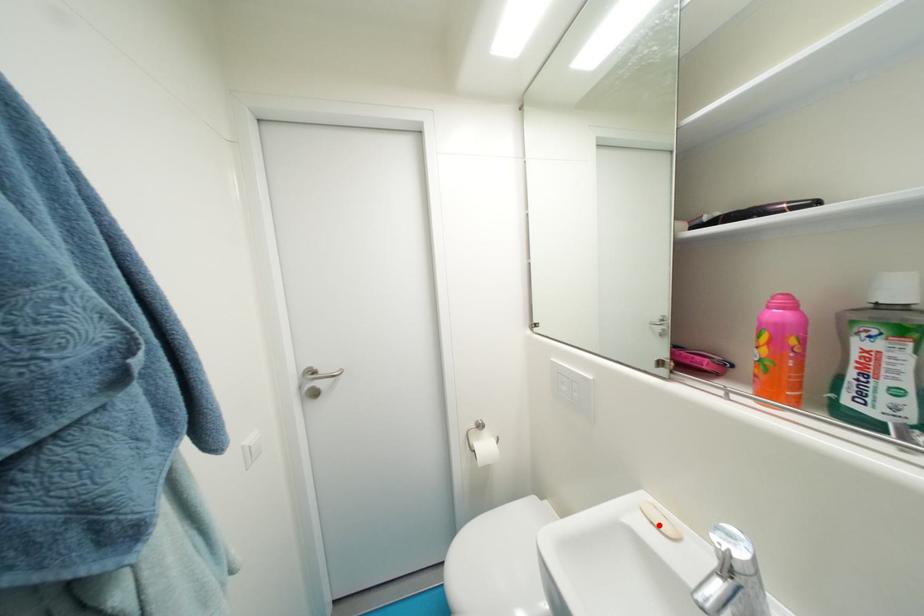
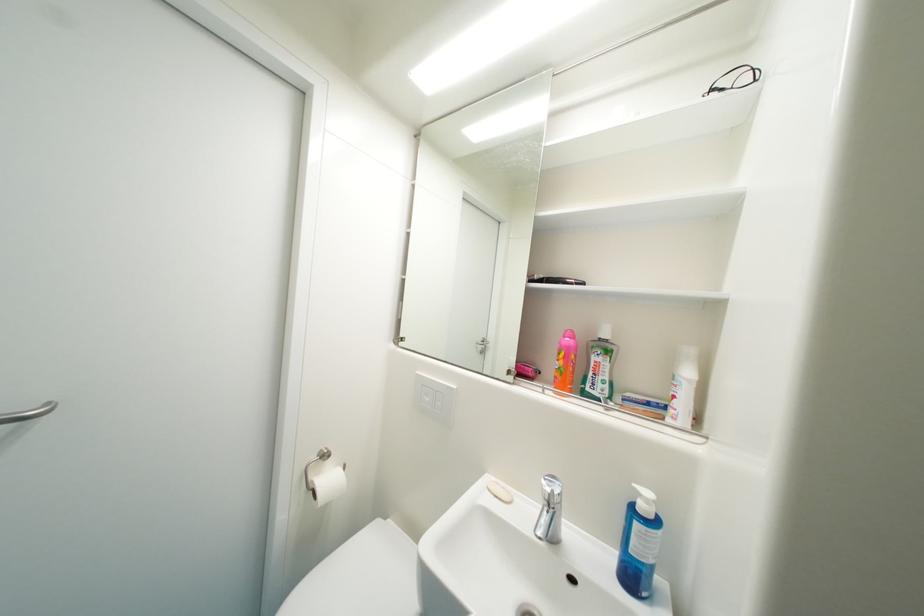
In the second image, find the point that corresponds to the highlighted location in the first image.

(503, 498)